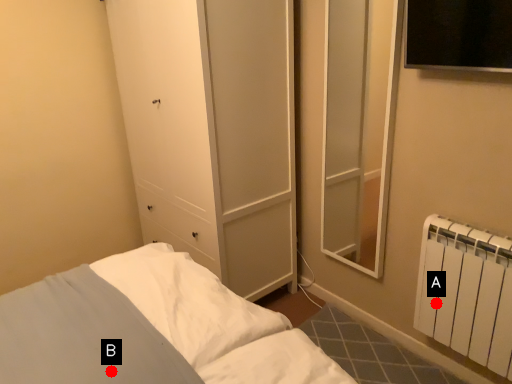
Question: Two points are circled on the image, labeled by A and B beside each circle. Which point appears farthest from the camera in this image?

Choices:
 (A) A is further
 (B) B is further

Answer: (A)